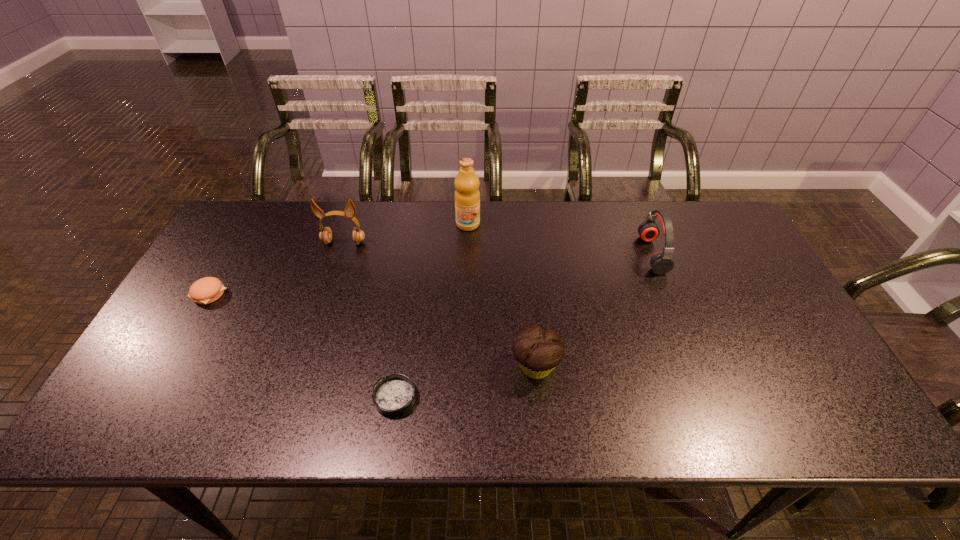
Image resolution: width=960 pixels, height=540 pixels. What are the coordinates of `ashtray` in the screenshot? It's located at click(x=394, y=395).

The width and height of the screenshot is (960, 540). What are the coordinates of `vacant space situated on the front label of the third object from right to left` in the screenshot? It's located at coord(467,269).

You are a GUI agent. You are given a task and a screenshot of the screen. Output one action in this format:
    pyautogui.click(x=<x>, y=<y>)
    Task: Click on the vacant point located 0.340m on the front-facing side of the fifth object from right to left
    
    Given the screenshot: What is the action you would take?
    pyautogui.click(x=313, y=338)

Find the location of a particular element. vacant space situated on the ear cups of the shorter earphone is located at coordinates (573, 254).

Locate an element on the screen. blank space located 0.250m on the ear cups of the shorter earphone is located at coordinates (561, 254).

Image resolution: width=960 pixels, height=540 pixels. Identify the location of vacant space located 0.190m on the ear cups of the shorter earphone. (580, 254).

Where is `free location located on the right of the third shortest object`? free location located on the right of the third shortest object is located at coordinates (726, 367).

Where is `vacant area situated 0.240m on the right of the patty`? vacant area situated 0.240m on the right of the patty is located at coordinates (313, 294).

Image resolution: width=960 pixels, height=540 pixels. I want to click on free space located on the back of the shortest object, so click(x=405, y=328).

Where is `fruit juice at the far edge`? fruit juice at the far edge is located at coordinates (467, 196).